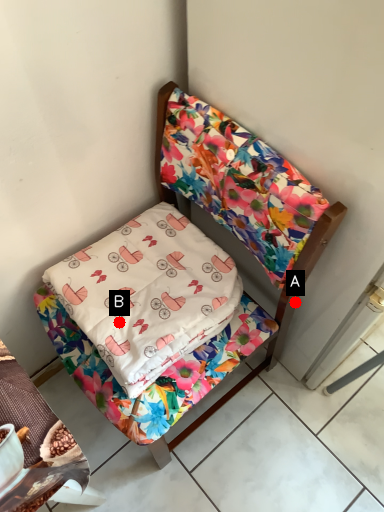
Question: Two points are circled on the image, labeled by A and B beside each circle. Among these points, which one is farthest from the camera?

Choices:
 (A) A is further
 (B) B is further

Answer: (A)